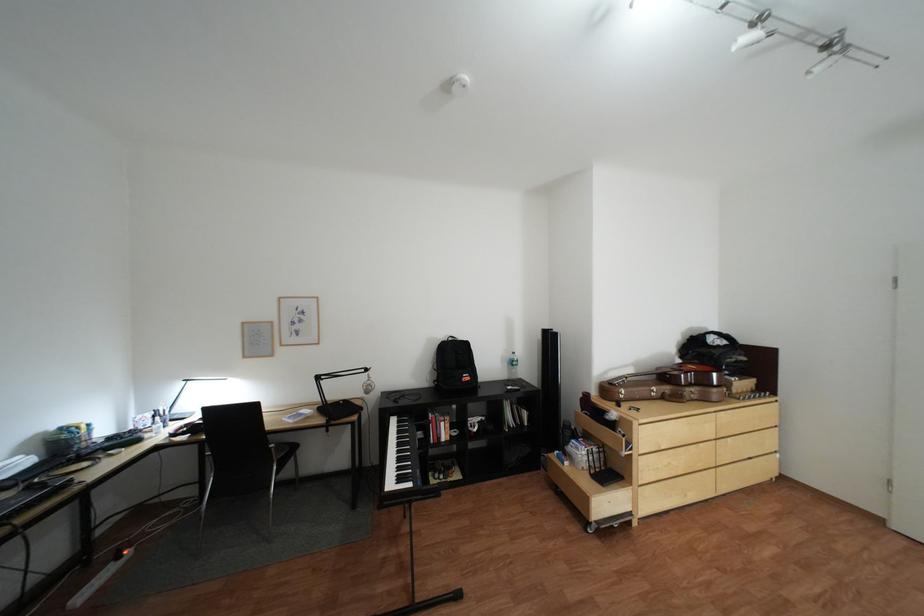
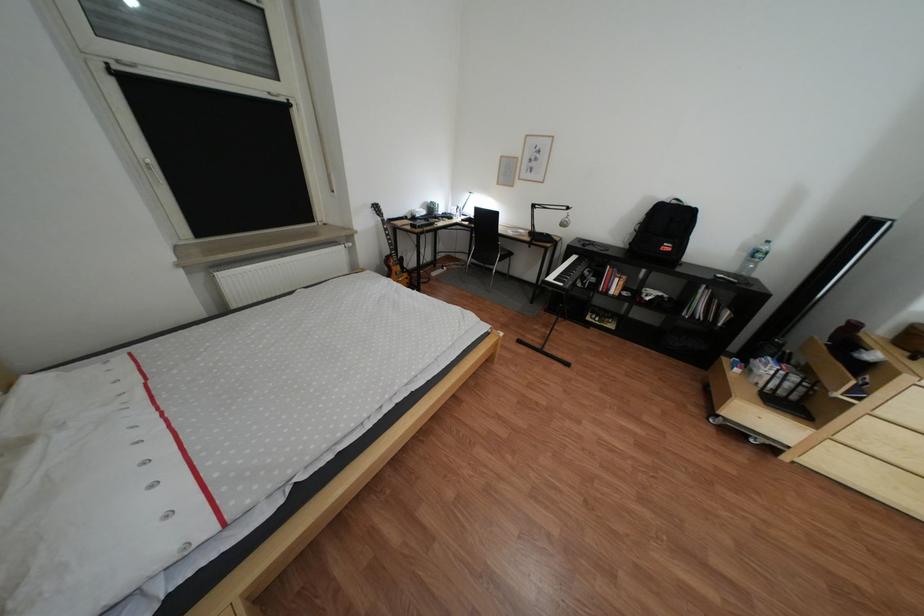
The point at (x=410, y=402) is marked in the first image. Where is the corresponding point in the second image?

(600, 246)